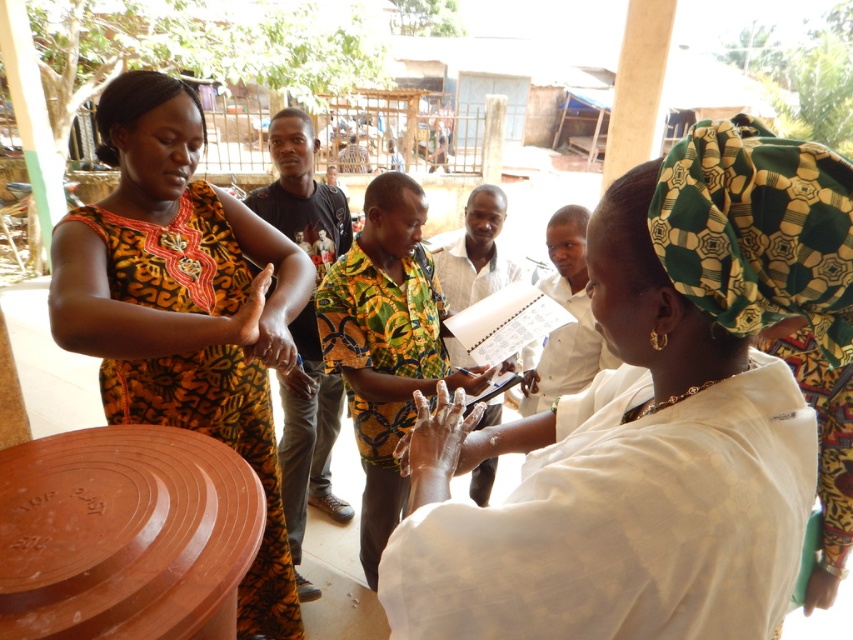
Is printed fabric dress at left further to the viewer compared to white cloth at center?

Yes, it is.

Between point (178, 211) and point (572, 269), which one is positioned behind?

Point (572, 269)

Is point (207, 228) in front of point (387, 554)?

No, it is behind (387, 554).

Identify the location of printed fabric dress at left. (225, 444).

Looking at this image, can you confirm if brown clay plate at center is positioned below white cloth at center?

Indeed, brown clay plate at center is positioned under white cloth at center.

Is brown clay plate at center taller than white cloth at center?

In fact, brown clay plate at center may be shorter than white cloth at center.

Is point (184, 513) positioned before point (425, 499)?

No, (184, 513) is further to viewer.

This screenshot has height=640, width=853. Identify the location of brown clay plate at center. (125, 534).

Is brown clay plate at center to the right of printed fabric dress at left from the viewer's perspective?

Indeed, brown clay plate at center is positioned on the right side of printed fabric dress at left.

Which of these two, brown clay plate at center or printed fabric dress at left, stands taller?

printed fabric dress at left

Does point (140, 593) lie in front of point (90, 211)?

Yes, it is.

Locate an element on the screen. Image resolution: width=853 pixels, height=640 pixels. brown clay plate at center is located at coordinates (125, 534).